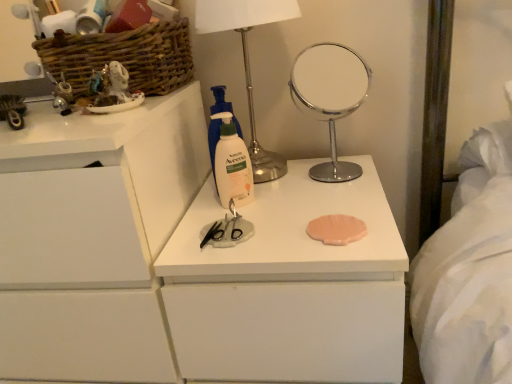
Where is `white matte chest of drawers at left, which appears as the second chest of drawers when viewed from the right`? white matte chest of drawers at left, which appears as the second chest of drawers when viewed from the right is located at coordinates (94, 237).

Locate an element on the screen. This screenshot has width=512, height=384. white matte aveeno lotion at center is located at coordinates (232, 165).

This screenshot has height=384, width=512. Describe the element at coordinates (123, 56) in the screenshot. I see `woven brown basket at upper left` at that location.

What do you see at coordinates (112, 91) in the screenshot? Image resolution: width=512 pixels, height=384 pixels. I see `matte white figurine at upper left` at bounding box center [112, 91].

From the picture: In order to face metallic silver table lamp at upper center, should I rotate leftwards or rightwards?

To face it directly, rotate right by 0.247 degrees.

Identify the location of white matte chest of drawers at center, which ranks as the 1th chest of drawers in right-to-left order. (289, 287).

Considering the relative sizes of white matte aveeno lotion at center and white matte chest of drawers at center, positioned as the 2th chest of drawers in left-to-right order, in the image provided, is white matte aveeno lotion at center smaller than white matte chest of drawers at center, positioned as the 2th chest of drawers in left-to-right order,?

Correct, white matte aveeno lotion at center occupies less space than white matte chest of drawers at center, positioned as the 2th chest of drawers in left-to-right order.

From a real-world perspective, which is physically below, white matte aveeno lotion at center or white matte chest of drawers at center, which ranks as the 1th chest of drawers in right-to-left order?

white matte chest of drawers at center, which ranks as the 1th chest of drawers in right-to-left order, is physically lower.

Locate an element on the screen. cleaning product lying on the left of white matte chest of drawers at center, positioned as the 2th chest of drawers in left-to-right order is located at coordinates coord(232,165).

How many degrees apart are the facing directions of white matte aveeno lotion at center and white matte chest of drawers at center, positioned as the 2th chest of drawers in left-to-right order?

The angle between the facing direction of white matte aveeno lotion at center and the facing direction of white matte chest of drawers at center, positioned as the 2th chest of drawers in left-to-right order, is 35.4 degrees.

From the image's perspective, is polished chrome mirror at center located above or below white matte aveeno lotion at center?

polished chrome mirror at center is situated higher than white matte aveeno lotion at center in the image.

Does polished chrome mirror at center appear on the left side of white matte aveeno lotion at center?

No, polished chrome mirror at center is not to the left of white matte aveeno lotion at center.

Measure the distance from polished chrome mirror at center to white matte aveeno lotion at center.

A distance of 3.07 meters exists between polished chrome mirror at center and white matte aveeno lotion at center.

Considering the sizes of objects polished chrome mirror at center and white matte aveeno lotion at center in the image provided, who is wider, polished chrome mirror at center or white matte aveeno lotion at center?

polished chrome mirror at center is wider.

Does matte white figurine at upper left appear on the right side of polished chrome mirror at center?

Incorrect, matte white figurine at upper left is not on the right side of polished chrome mirror at center.

Which is nearer, (x=95, y=75) or (x=308, y=95)?

The point (x=95, y=75) is closer.

Does matte white figurine at upper left have a smaller size compared to polished chrome mirror at center?

Yes, matte white figurine at upper left is smaller than polished chrome mirror at center.

Identify the location of mirror lying on the right of matte white figurine at upper left. (330, 97).

Looking at this image, is woven brown basket at upper left oriented away from metallic silver table lamp at upper center?

woven brown basket at upper left does not have its back to metallic silver table lamp at upper center.

From the image's perspective, which object appears higher, woven brown basket at upper left or metallic silver table lamp at upper center?

woven brown basket at upper left is shown above in the image.

Which of these two, woven brown basket at upper left or metallic silver table lamp at upper center, is bigger?

metallic silver table lamp at upper center.

Considering the sizes of white matte chest of drawers at left, placed as the first chest of drawers when sorted from left to right, and matte white figurine at upper left in the image, is white matte chest of drawers at left, placed as the first chest of drawers when sorted from left to right, taller or shorter than matte white figurine at upper left?

Considering their sizes, white matte chest of drawers at left, placed as the first chest of drawers when sorted from left to right, has more height than matte white figurine at upper left.

Considering the points (48, 324) and (104, 94), which point is behind, point (48, 324) or point (104, 94)?

Positioned behind is point (48, 324).

Looking at their sizes, would you say white matte chest of drawers at left, which appears as the second chest of drawers when viewed from the right, is wider or thinner than matte white figurine at upper left?

white matte chest of drawers at left, which appears as the second chest of drawers when viewed from the right, is wider than matte white figurine at upper left.

Which object is more forward, white matte chest of drawers at left, placed as the first chest of drawers when sorted from left to right, or matte white figurine at upper left?

white matte chest of drawers at left, placed as the first chest of drawers when sorted from left to right, is more forward.

Does woven brown basket at upper left appear on the left side of matte white figurine at upper left?

Yes, woven brown basket at upper left is to the left of matte white figurine at upper left.

Is woven brown basket at upper left located outside matte white figurine at upper left?

Yes.

Is woven brown basket at upper left wider or thinner than matte white figurine at upper left?

Clearly, woven brown basket at upper left has more width compared to matte white figurine at upper left.

Measure the distance from woven brown basket at upper left to matte white figurine at upper left.

woven brown basket at upper left and matte white figurine at upper left are 4.32 inches apart.

Is polished chrome mirror at center situated inside matte white figurine at upper left or outside?

polished chrome mirror at center is outside matte white figurine at upper left.

Is polished chrome mirror at center positioned with its back to matte white figurine at upper left?

No, matte white figurine at upper left is not at the back of polished chrome mirror at center.

The width and height of the screenshot is (512, 384). I want to click on mirror below the matte white figurine at upper left (from a real-world perspective), so click(x=330, y=97).

Considering the sizes of polished chrome mirror at center and matte white figurine at upper left in the image, is polished chrome mirror at center taller or shorter than matte white figurine at upper left?

Clearly, polished chrome mirror at center is taller compared to matte white figurine at upper left.

Locate an element on the screen. the 2nd chest of drawers below the white matte aveeno lotion at center (from the image's perspective) is located at coordinates (289, 287).

Image resolution: width=512 pixels, height=384 pixels. In the image, there is a white matte aveeno lotion at center. Find the location of `mirror above it (from the image's perspective)`. mirror above it (from the image's perspective) is located at coordinates (330, 97).

When comparing their distances from white matte aveeno lotion at center, does metallic silver table lamp at upper center or polished chrome mirror at center seem closer?

metallic silver table lamp at upper center is positioned closer to the anchor white matte aveeno lotion at center.

From the image, which object appears to be nearer to polished chrome mirror at center, white matte chest of drawers at left, which appears as the second chest of drawers when viewed from the right, or white matte chest of drawers at center, positioned as the 2th chest of drawers in left-to-right order?

white matte chest of drawers at center, positioned as the 2th chest of drawers in left-to-right order.

Considering their positions, is polished chrome mirror at center positioned further to white matte chest of drawers at center, which ranks as the 1th chest of drawers in right-to-left order, than matte white figurine at upper left?

polished chrome mirror at center lies further to white matte chest of drawers at center, which ranks as the 1th chest of drawers in right-to-left order, than the other object.

Considering their positions, is woven brown basket at upper left positioned further to polished chrome mirror at center than matte white figurine at upper left?

matte white figurine at upper left is positioned further to the anchor polished chrome mirror at center.

From the image, which object appears to be farther from polished chrome mirror at center, white matte chest of drawers at center, positioned as the 2th chest of drawers in left-to-right order, or matte white figurine at upper left?

Among the two, white matte chest of drawers at center, positioned as the 2th chest of drawers in left-to-right order, is located further to polished chrome mirror at center.

Based on their spatial positions, is white matte chest of drawers at left, which appears as the second chest of drawers when viewed from the right, or matte white figurine at upper left further from white matte chest of drawers at center, which ranks as the 1th chest of drawers in right-to-left order?

matte white figurine at upper left is further to white matte chest of drawers at center, which ranks as the 1th chest of drawers in right-to-left order.

Which object lies nearer to the anchor point white matte chest of drawers at left, which appears as the second chest of drawers when viewed from the right, matte white figurine at upper left or polished chrome mirror at center?

matte white figurine at upper left lies closer to white matte chest of drawers at left, which appears as the second chest of drawers when viewed from the right, than the other object.

Looking at the image, which one is located closer to woven brown basket at upper left, white matte chest of drawers at center, positioned as the 2th chest of drawers in left-to-right order, or white matte chest of drawers at left, placed as the first chest of drawers when sorted from left to right?

Among the two, white matte chest of drawers at left, placed as the first chest of drawers when sorted from left to right, is located nearer to woven brown basket at upper left.

Where is `mirror between matte white figurine at upper left and white matte chest of drawers at center, positioned as the 2th chest of drawers in left-to-right order, from top to bottom`? Image resolution: width=512 pixels, height=384 pixels. mirror between matte white figurine at upper left and white matte chest of drawers at center, positioned as the 2th chest of drawers in left-to-right order, from top to bottom is located at coordinates (330, 97).

Identify the location of cleaning product between woven brown basket at upper left and white matte chest of drawers at center, which ranks as the 1th chest of drawers in right-to-left order, from top to bottom. This screenshot has height=384, width=512. (x=232, y=165).

This screenshot has width=512, height=384. I want to click on toy between metallic silver table lamp at upper center and white matte chest of drawers at center, positioned as the 2th chest of drawers in left-to-right order, from top to bottom, so click(112, 91).

What are the coordinates of `toy between woven brown basket at upper left and white matte chest of drawers at left, placed as the first chest of drawers when sorted from left to right, from top to bottom` in the screenshot? It's located at (112, 91).